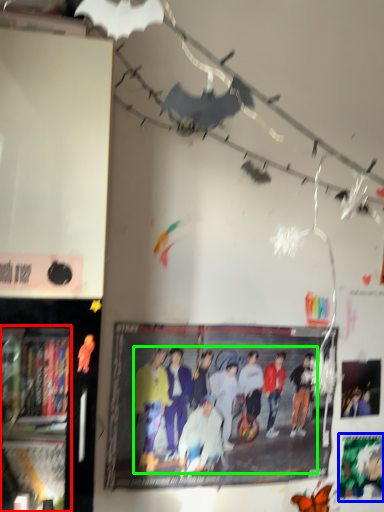
Question: Considering the real-world distances, which object is farthest from bookshelf (highlighted by a red box)? poster page (highlighted by a blue box) or person (highlighted by a green box)?

Choices:
 (A) poster page
 (B) person

Answer: (A)